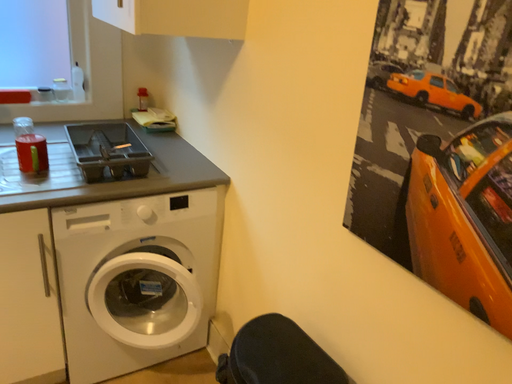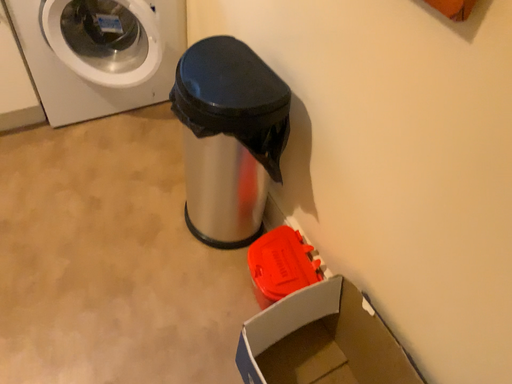
Question: How did the camera likely rotate when shooting the video?

Choices:
 (A) rotated downward
 (B) rotated upward

Answer: (A)